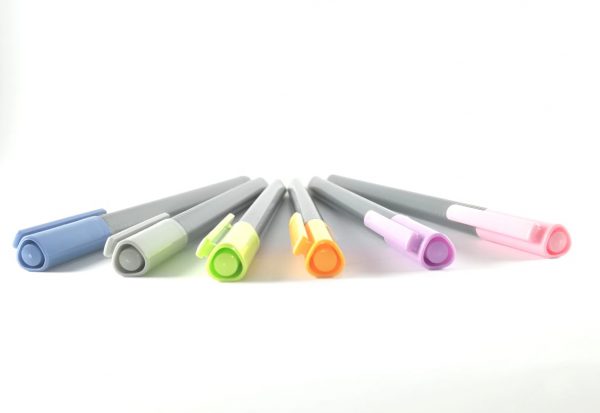
Image resolution: width=600 pixels, height=413 pixels. What are the coordinates of `pens` in the screenshot? It's located at (180, 198), (199, 205), (260, 210), (309, 203), (353, 203), (406, 197).